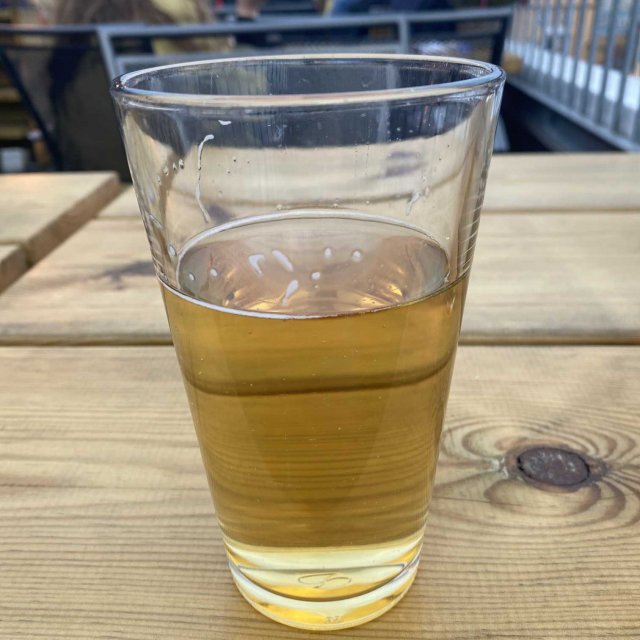
Where is `beige chair`? beige chair is located at coordinates (191, 40).